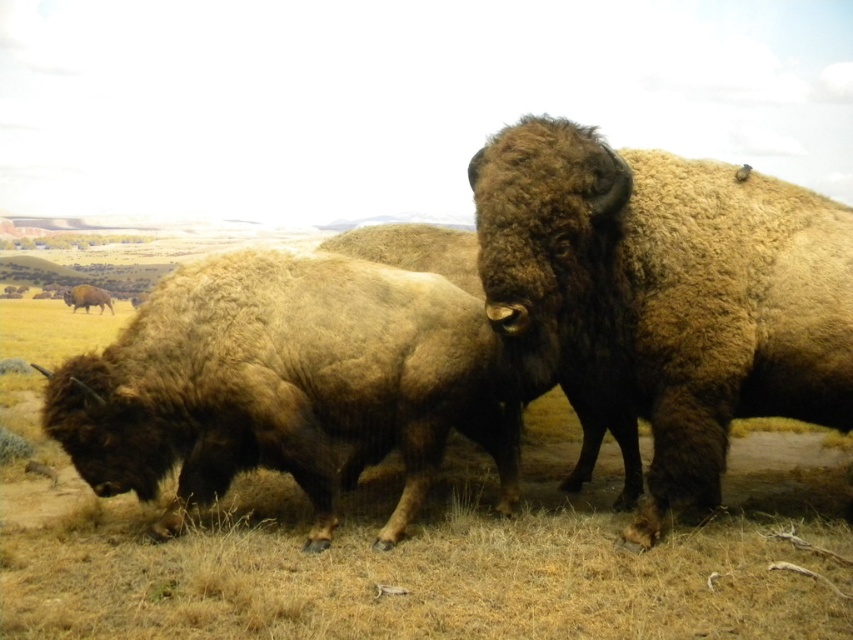
You are a wildlife photographer aiming to capture a closeup shot of the brown fuzzy bison at center and the brown fuzzy bison at lower left. Given that your camera can only focus on one bison at a time, which bison would you need to adjust your focus settings for to ensure it is in sharp detail?

The brown fuzzy bison at center is wider than the brown fuzzy bison at lower left. Therefore, you should adjust your focus settings for the brown fuzzy bison at center to ensure it is in sharp detail.

You are a wildlife photographer aiming to capture a photo of both the brown fuzzy bison at center and the brown fuzzy bison at lower left in the same frame. Based on their positions, which bison is located to the right of the other?

The brown fuzzy bison at center is positioned on the right side of brown fuzzy bison at lower left, so the brown fuzzy bison at center is to the right of the brown fuzzy bison at lower left.

You are a wildlife photographer standing in the field with your camera. You want to capture a closeup shot of the brown fuzzy bison at center. If your camera can focus on subjects within 2 meters, will you be able to take the closeup?

The brown fuzzy bison at center is 2.79 meters away from the camera. Since your camera can focus within 2 meters, you are too far to take the closeup.